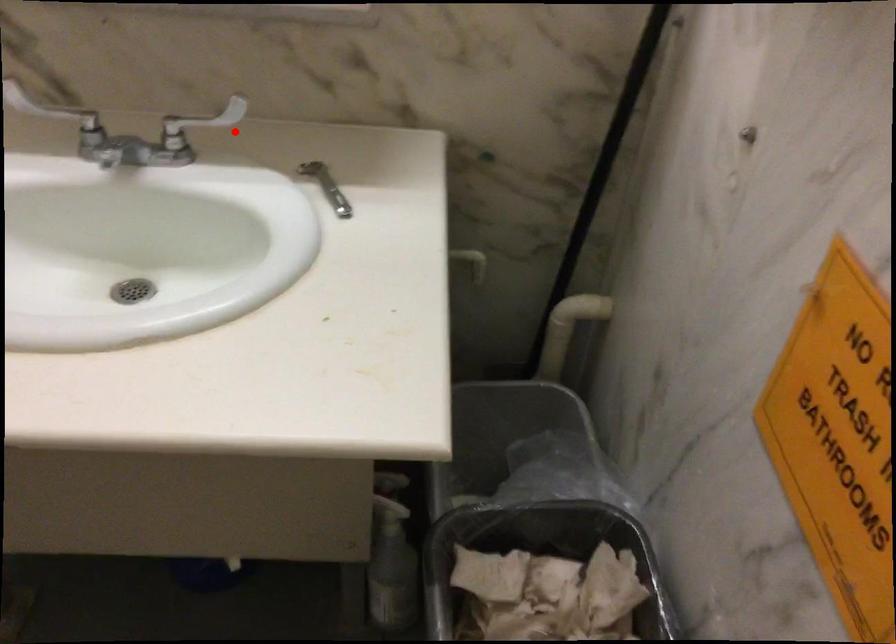
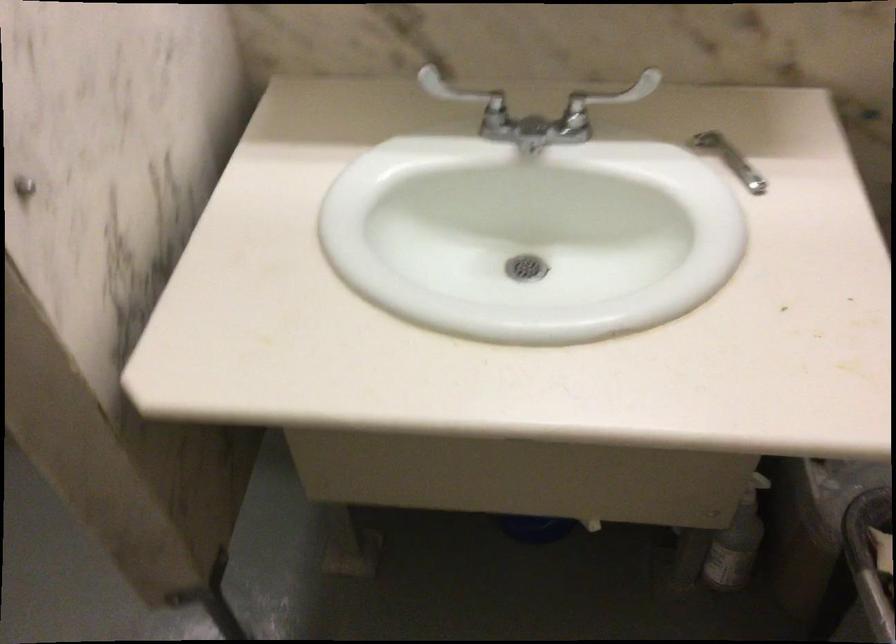
Find the pixel in the second image that matches the highlighted location in the first image.

(608, 98)